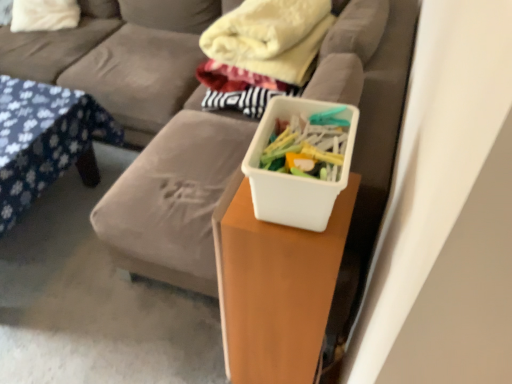
Question: Is soft gray couch at center to the left or to the right of white soft pillow at upper left in the image?

Choices:
 (A) right
 (B) left

Answer: (A)

Question: Do you think soft gray couch at center is within white soft pillow at upper left, or outside of it?

Choices:
 (A) inside
 (B) outside

Answer: (B)

Question: Which is nearer to the soft yellow blanket at upper center?

Choices:
 (A) white soft pillow at upper left
 (B) soft gray couch at center
 (C) white matte plastic container at center
 (D) white plastic container at center
 (E) gray fabric couch at center

Answer: (E)

Question: Which object is positioned farthest from the white plastic container at center?

Choices:
 (A) white matte plastic container at center
 (B) white soft pillow at upper left
 (C) soft yellow blanket at upper center
 (D) blue floral fabric at left
 (E) gray fabric couch at center

Answer: (B)